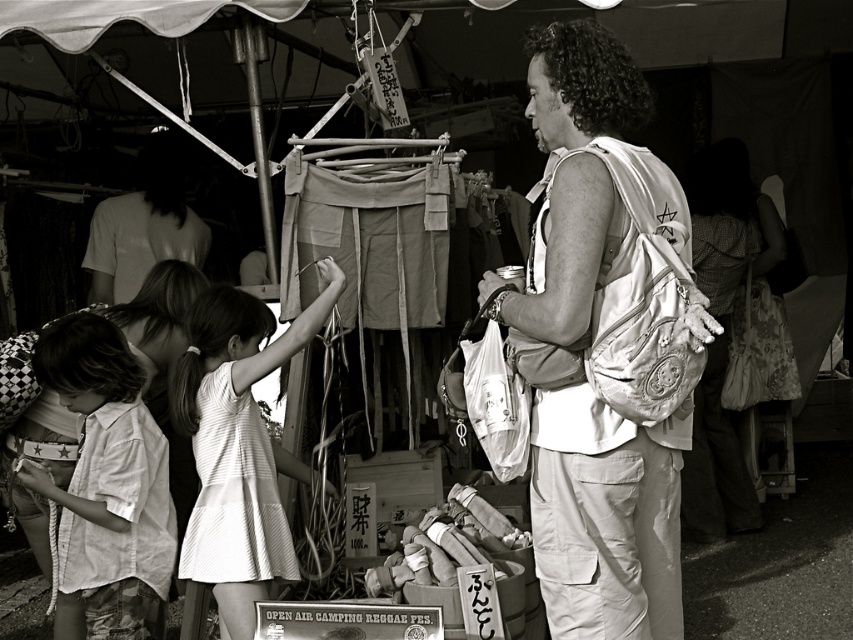
Which is below, white fabric bag at center or white cotton shirt at upper left?

Positioned lower is white fabric bag at center.

Can you confirm if white fabric bag at center is smaller than white cotton shirt at upper left?

Incorrect, white fabric bag at center is not smaller in size than white cotton shirt at upper left.

Find the location of a particular element. The image size is (853, 640). white fabric bag at center is located at coordinates (605, 346).

What are the coordinates of `white cotton shirt at lower left` in the screenshot? It's located at (109, 481).

Is white cotton shirt at lower left thinner than white cotton shirt at upper left?

Correct, white cotton shirt at lower left's width is less than white cotton shirt at upper left's.

Is point (21, 465) positioned before point (161, 212)?

Yes, point (21, 465) is in front of point (161, 212).

I want to click on white cotton shirt at lower left, so click(109, 481).

Is white striped dress at center to the left of white cotton shirt at upper left from the viewer's perspective?

No, white striped dress at center is not to the left of white cotton shirt at upper left.

Who is taller, white striped dress at center or white cotton shirt at upper left?

With more height is white striped dress at center.

Is point (227, 538) positioned after point (189, 253)?

No, (227, 538) is closer to viewer.

The height and width of the screenshot is (640, 853). I want to click on white striped dress at center, so click(236, 444).